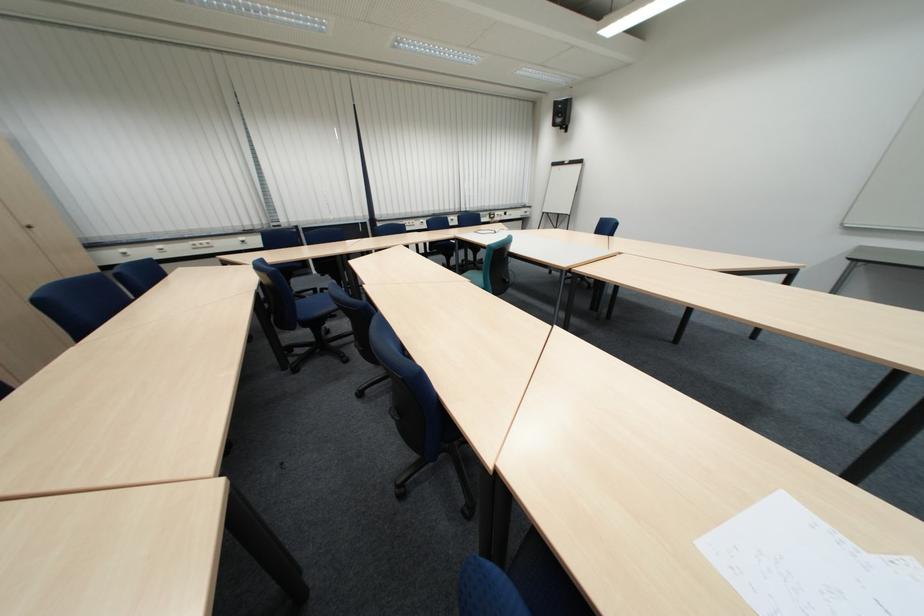
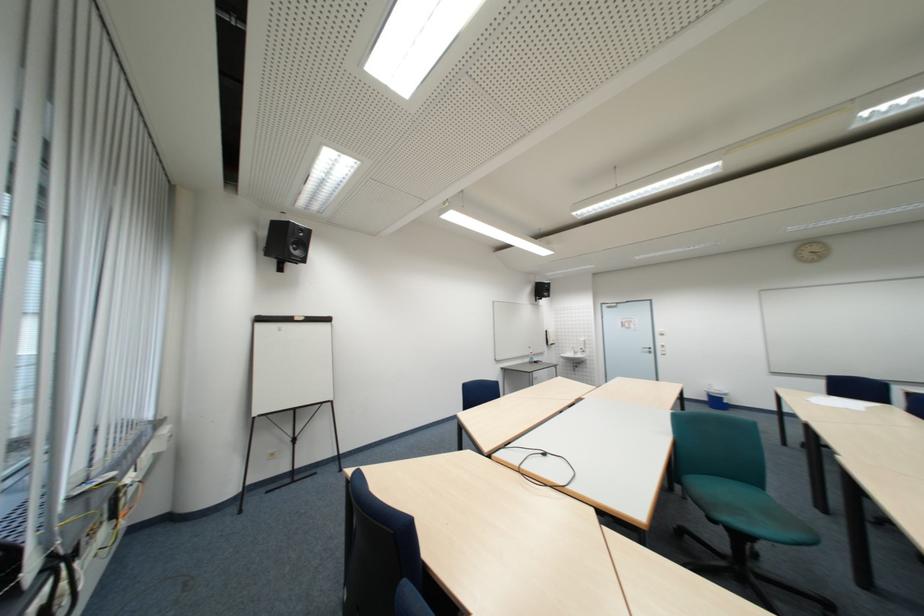
Find the pixel in the second image that matches pixel 566 166 in the first image.

(273, 321)